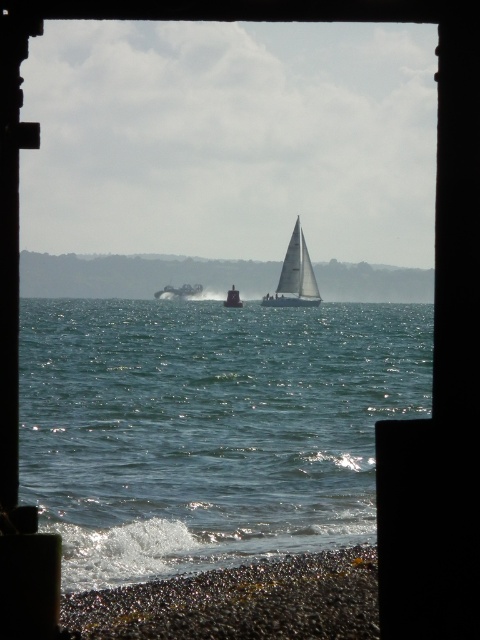
You are standing at the beach looking through the frame. Which object, the clear blue water at center or the white sailboat at center, is closer to you?

The clear blue water at center is closer to you because it is in front of the white sailboat at center.

You are standing on the beach and want to determine which boat is closer to you. The scene has a metallic silver boat at center and a white plastic sailboat at center. Based on their sizes, which boat is closer?

The metallic silver boat at center is much taller than the white plastic sailboat at center, so it is closer to you.